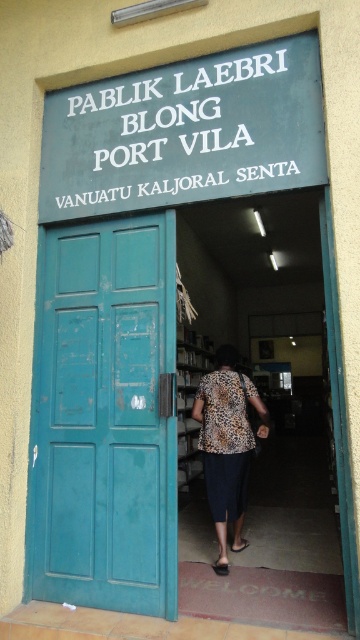
You are standing at the entrance of the Public Library of Port Vila and notice the leopard print blouse at center and the matte wood bookshelf at center. Which object is shorter?

The leopard print blouse at center is shorter than the matte wood bookshelf at center.

You are a delivery person standing at the entrance of the Public Library of Port Vila. You need to place a package that is 1 meter long on the floor between the teal matte door at left and the green painted signboard at upper center. Is there enough space for the package?

The distance between the teal matte door at left and the green painted signboard at upper center is 87.20 centimeters. Since the package is 1 meter long, which is longer than the available space, the package will not fit.